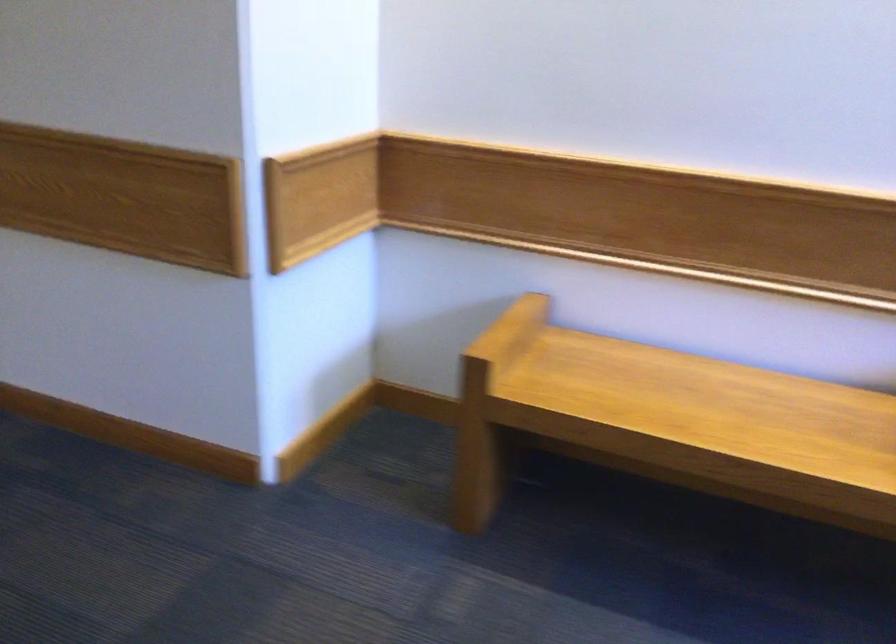
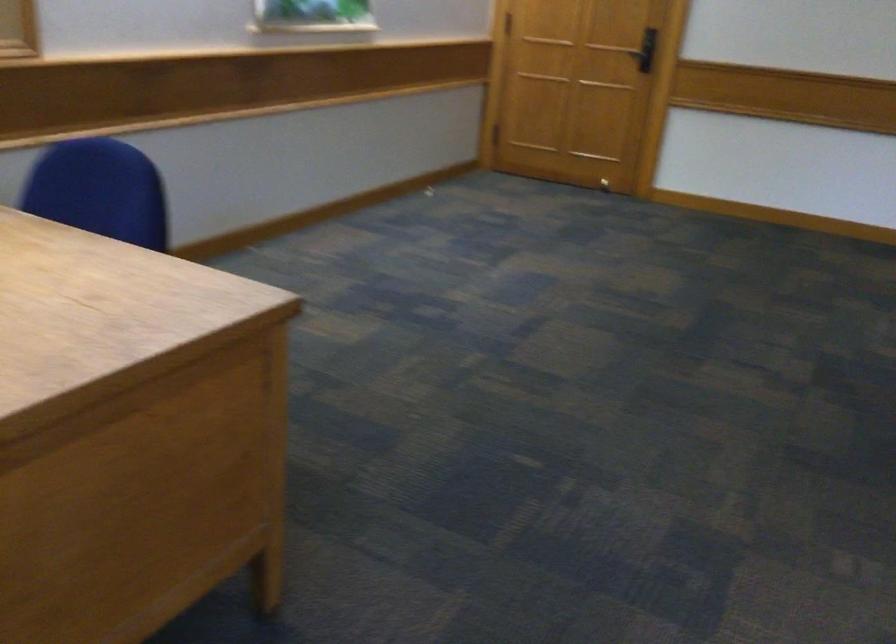
The images are taken continuously from a first-person perspective. In which direction is your viewpoint rotating?

The rotation direction of the camera is left-down.